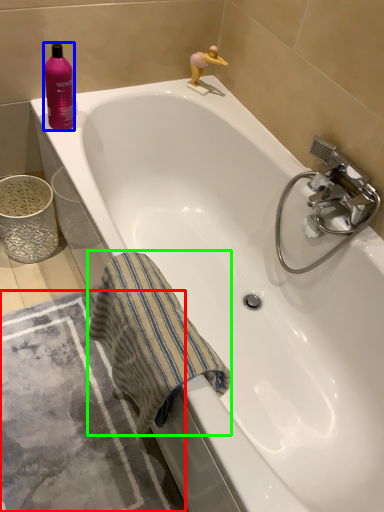
Question: Based on their relative distances, which object is nearer to bath mat (highlighted by a red box)? Choose from cleaning product (highlighted by a blue box) and beach towel (highlighted by a green box).

Choices:
 (A) cleaning product
 (B) beach towel

Answer: (B)